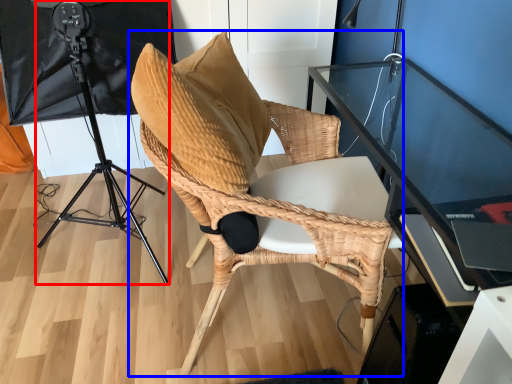
Question: Which of the following is the farthest to the observer, tripod (highlighted by a red box) or chair (highlighted by a blue box)?

Choices:
 (A) tripod
 (B) chair

Answer: (A)